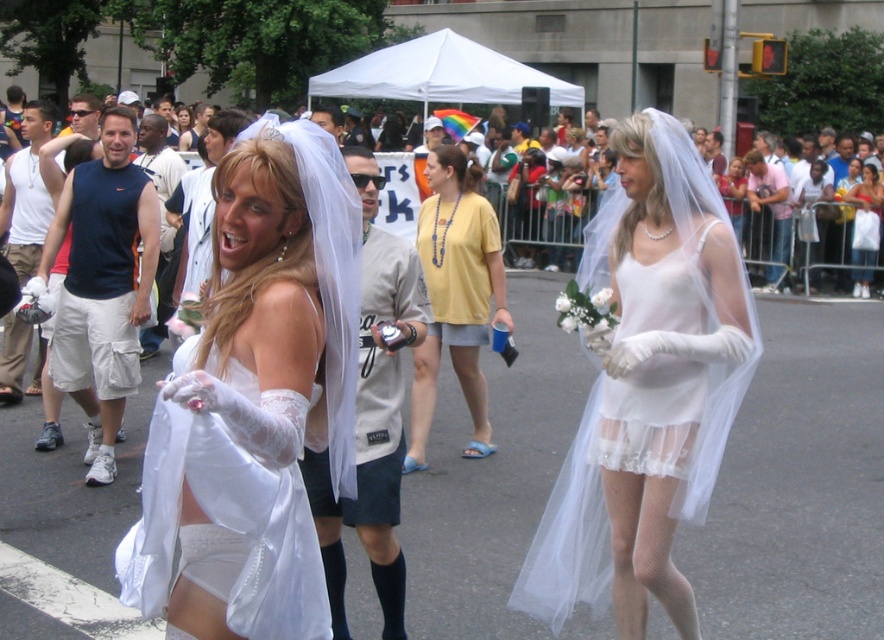
Looking at this image, you are a photographer positioned at the center of the street where the lively parade is happening. You want to take a photo of both the point at coordinates point (29, 394) and point (725, 173). Based on their positions, which point should you focus on first to ensure both are in frame?

Point (29, 394) is in front of point (725, 173), so you should focus on point (29, 394) first to ensure both are in frame as it is closer to you.

You are a photographer trying to capture the best shot of the white cotton tank top at left and the white sheer veil at center. Which object should you focus on first if you want to photograph the one closer to the ground?

The white cotton tank top at left is below the white sheer veil at center, so you should focus on the white cotton tank top at left first since it is closer to the ground.